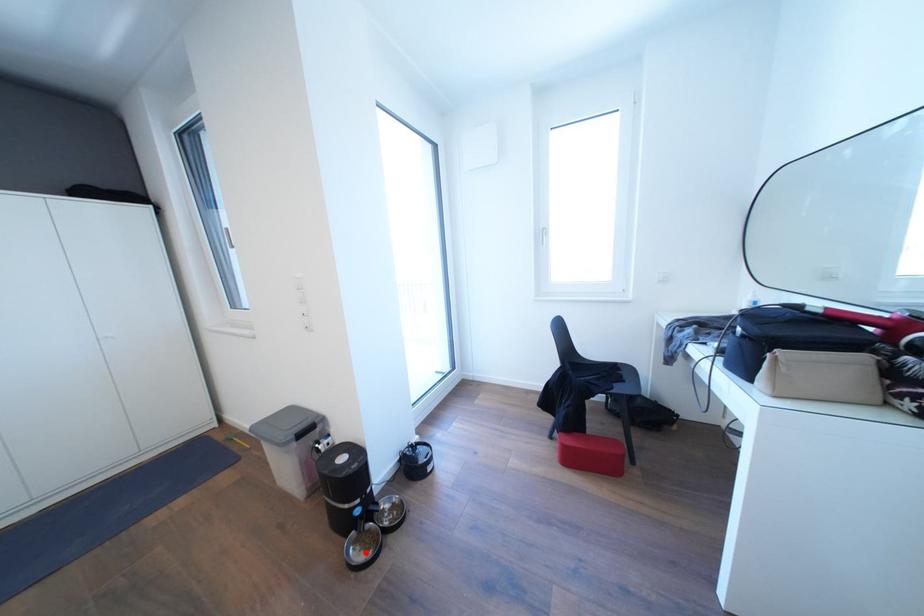
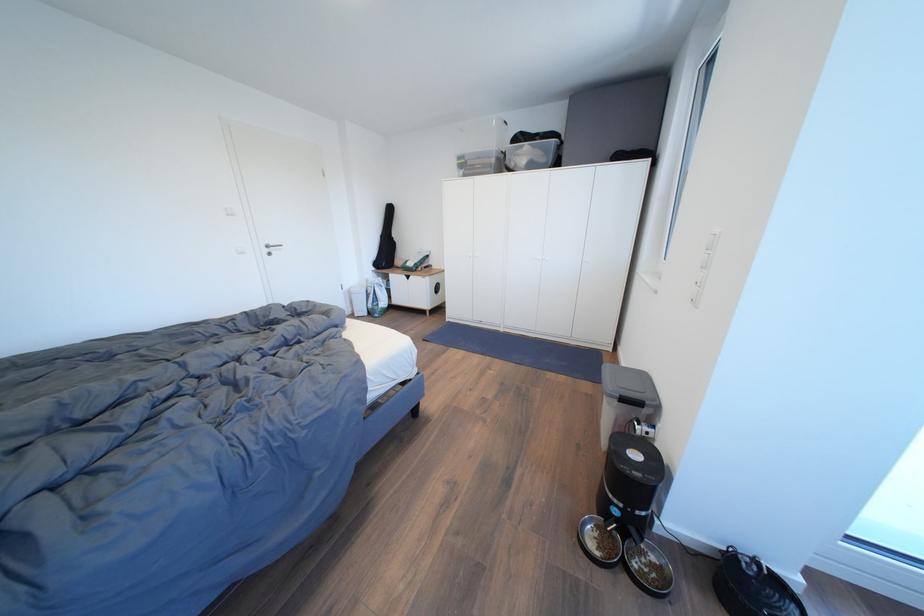
The point at the highlighted location is marked in the first image. Where is the corresponding point in the second image?

(603, 540)